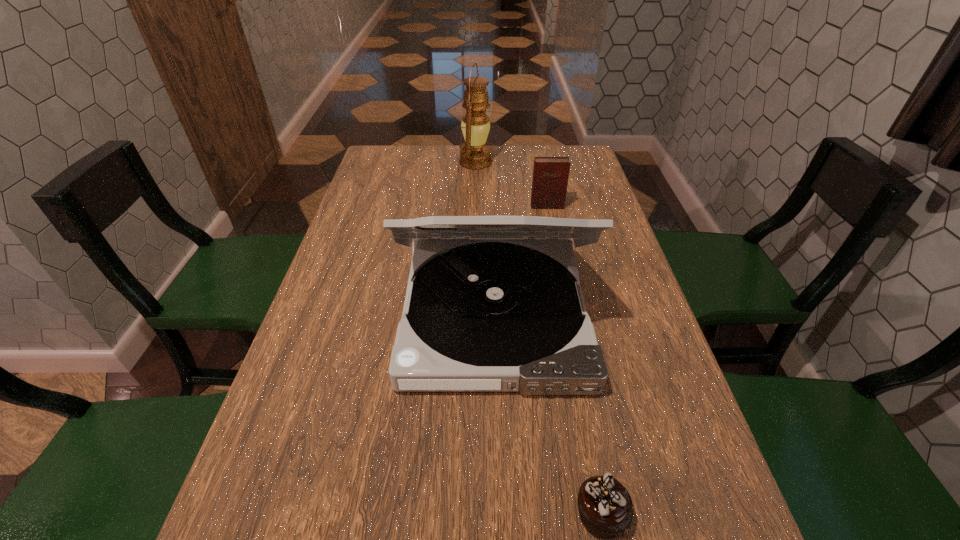
The image size is (960, 540). In order to click on oil lamp in this screenshot , I will do `click(474, 155)`.

You are a GUI agent. You are given a task and a screenshot of the screen. Output one action in this format:
    pyautogui.click(x=<x>, y=<y>)
    Task: Click on the CD player
    
    Given the screenshot: What is the action you would take?
    pyautogui.click(x=494, y=305)

At what (x,y) coordinates should I click in order to perform the action: click on the second farthest object. Please return your answer as a coordinate pair (x, y). Looking at the image, I should click on (550, 174).

The height and width of the screenshot is (540, 960). Find the location of `the third tallest object`. the third tallest object is located at coordinates (550, 174).

At what (x,y) coordinates should I click in order to perform the action: click on free region located 0.300m on the right of the farthest object. Please return your answer as a coordinate pair (x, y). This screenshot has height=540, width=960. Looking at the image, I should click on (579, 162).

At what (x,y) coordinates should I click in order to perform the action: click on vacant space located 0.180m on the control panel of the CD player. Please return your answer as a coordinate pair (x, y). The image size is (960, 540). Looking at the image, I should click on (500, 500).

Identify the location of free point located on the front cover of the second farthest object. Image resolution: width=960 pixels, height=540 pixels. (560, 269).

Find the location of `object situated at the far edge`. object situated at the far edge is located at coordinates (474, 155).

At what (x,y) coordinates should I click in order to perform the action: click on CD player that is at the right edge. Please return your answer as a coordinate pair (x, y). Looking at the image, I should click on (494, 305).

Find the location of `diary that is at the right edge`. diary that is at the right edge is located at coordinates (550, 174).